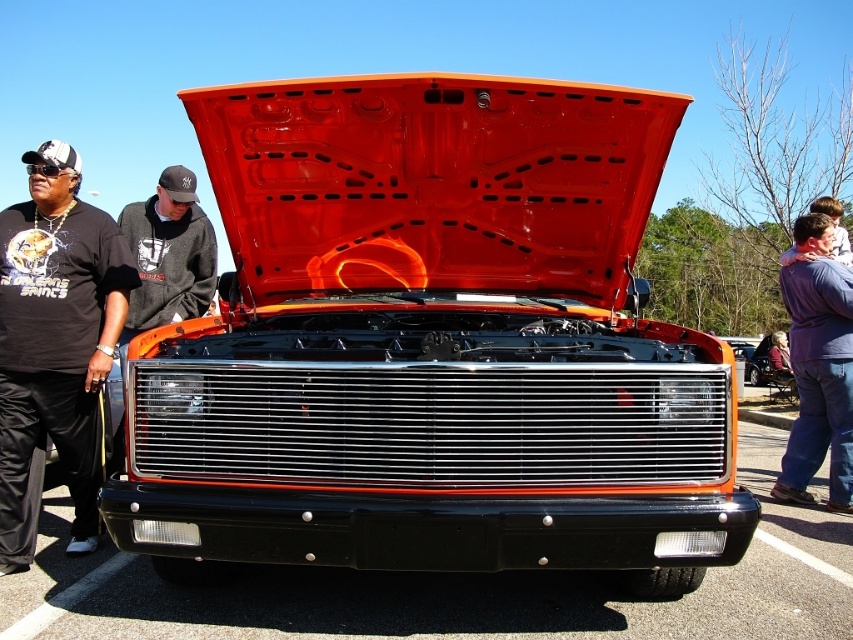
Question: Which point is closer to the camera?

Choices:
 (A) (645, 387)
 (B) (86, 403)
 (C) (753, 618)

Answer: (A)

Question: Is black plastic bumper at center to the left of blue denim jeans at right from the viewer's perspective?

Choices:
 (A) no
 (B) yes

Answer: (B)

Question: Observing the image, what is the correct spatial positioning of black fabric shirt at left in reference to blue denim jeans at right?

Choices:
 (A) below
 (B) above

Answer: (B)

Question: Which point is closer to the camera?

Choices:
 (A) black plastic bumper at center
 (B) shiny chrome grille at center

Answer: (B)

Question: Which point is farther from the camera taking this photo?

Choices:
 (A) click(x=193, y=608)
 (B) click(x=27, y=308)
 (C) click(x=808, y=502)
 (D) click(x=619, y=214)

Answer: (C)

Question: Is black plastic bumper at center bigger than blue denim jeans at right?

Choices:
 (A) yes
 (B) no

Answer: (B)